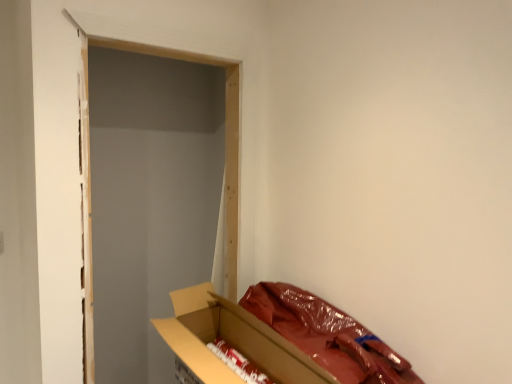
Describe the element at coordinates (278, 338) in the screenshot. This screenshot has width=512, height=384. I see `cardboard box at lower right` at that location.

Consider the image. What is the approximate width of cardboard box at lower right?

It is 14.72 inches.

Locate an element on the screen. The image size is (512, 384). cardboard box at lower right is located at coordinates (278, 338).

Identify the location of cardboard box at lower right. (278, 338).